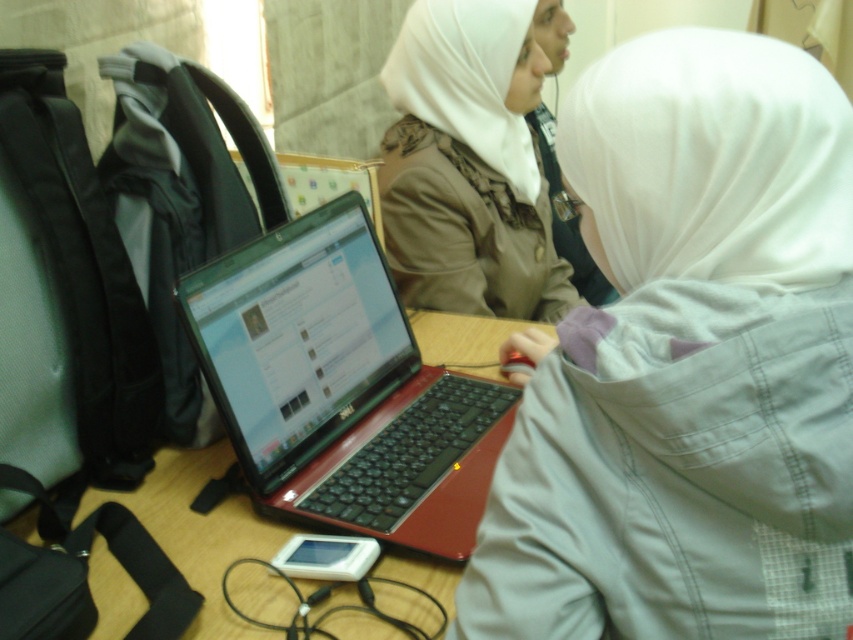
Question: Is white matte hijab at center above shiny black laptop at center?

Choices:
 (A) yes
 (B) no

Answer: (A)

Question: Can you confirm if white matte hijab at center is smaller than wooden table at center?

Choices:
 (A) no
 (B) yes

Answer: (A)

Question: Is shiny black laptop at center below white matte veil at upper center?

Choices:
 (A) no
 (B) yes

Answer: (B)

Question: Based on their relative distances, which object is nearer to the white soft veil at upper right?

Choices:
 (A) white matte veil at upper center
 (B) white matte hijab at center
 (C) wooden table at center
 (D) shiny black laptop at center

Answer: (B)

Question: Which point is farther from the camera taking this photo?

Choices:
 (A) (799, 92)
 (B) (755, 70)
 (C) (399, 596)
 (D) (430, 284)

Answer: (D)

Question: Which point is closer to the camera?

Choices:
 (A) white soft veil at upper right
 (B) wooden table at center
 (C) white matte veil at upper center

Answer: (A)